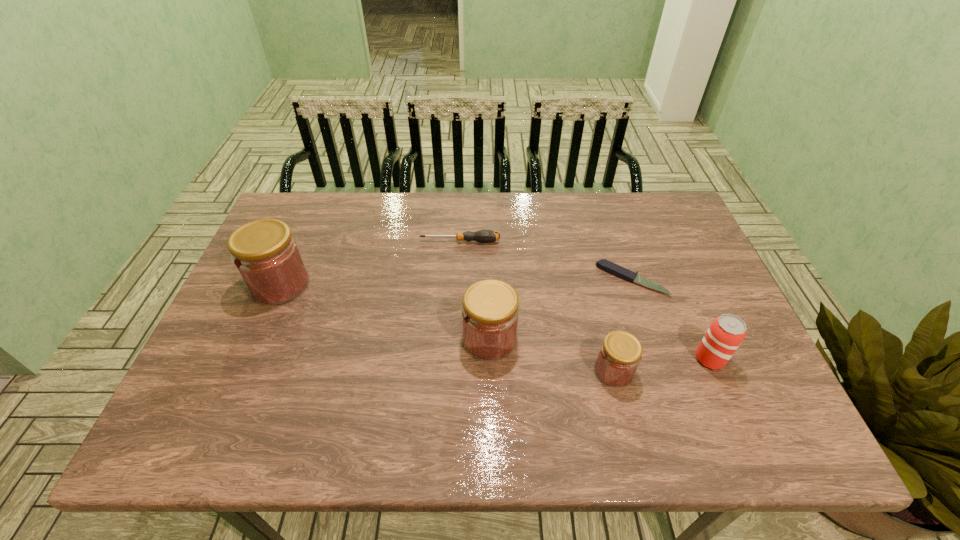
Locate an element on the screen. the leftmost jam is located at coordinates (266, 255).

Where is `the leftmost object`? the leftmost object is located at coordinates (266, 255).

This screenshot has width=960, height=540. I want to click on the second jam from left to right, so click(490, 312).

You are a GUI agent. You are given a task and a screenshot of the screen. Output one action in this format:
    pyautogui.click(x=<x>, y=<y>)
    Task: Click on the shortest jam
    The height and width of the screenshot is (540, 960).
    Given the screenshot: What is the action you would take?
    pyautogui.click(x=619, y=356)

Where is `the third shortest object`? the third shortest object is located at coordinates (619, 356).

Identify the location of the farthest object. This screenshot has height=540, width=960. (485, 236).

Find the location of `screwdriver`. screwdriver is located at coordinates (485, 236).

Identify the location of beer can. pos(725,334).

Where is `steak knife`? steak knife is located at coordinates (608, 266).

At what (x,y) coordinates should I click in order to perform the action: click on vacant space located on the back of the leftmost jam. Please return your answer as a coordinate pair (x, y). Looking at the image, I should click on (308, 220).